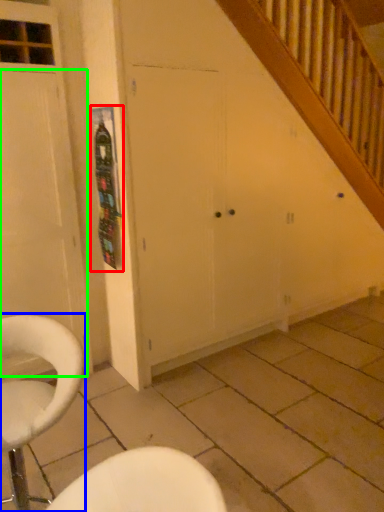
Question: Estimate the real-world distances between objects in this image. Which object is closer to bulletin board (highlighted by a red box), chair (highlighted by a blue box) or door (highlighted by a green box)?

Choices:
 (A) chair
 (B) door

Answer: (B)